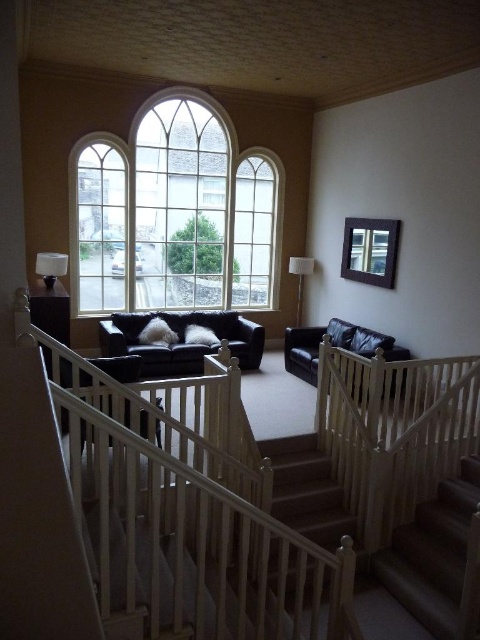
Question: Is dark brown carpeted stairs at center positioned behind clear glass window at upper left?

Choices:
 (A) no
 (B) yes

Answer: (A)

Question: Which object is positioned closest to the clear glass window at upper left?

Choices:
 (A) clear glass window at center
 (B) matte black window at upper center

Answer: (A)

Question: Which object is farther from the camera taking this photo?

Choices:
 (A) matte black window at upper center
 (B) leather armchair at lower right

Answer: (A)

Question: Does wooden staircase at center come behind matte white lamp at center?

Choices:
 (A) yes
 (B) no

Answer: (B)

Question: Based on their relative distances, which object is farther from the wooden staircase at center?

Choices:
 (A) matte black couch at center
 (B) dark brown carpeted stairs at center
 (C) matte black lamp at left

Answer: (C)

Question: Does dark brown carpeted stairs at center come behind matte white lamp at center?

Choices:
 (A) yes
 (B) no

Answer: (B)